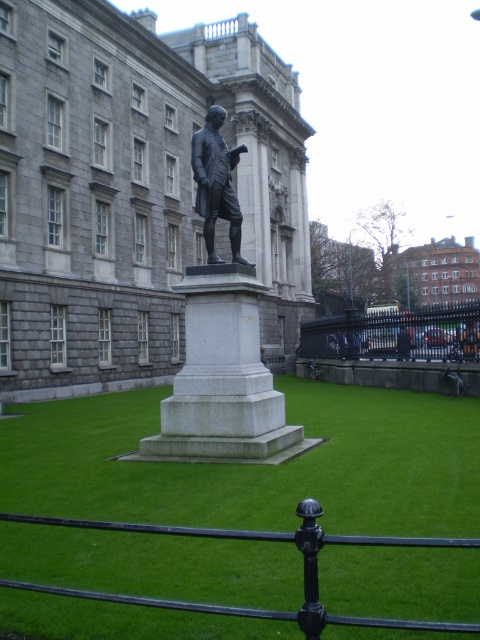
Question: Does polished bronze statue at center appear on the left side of bronze statue at center?

Choices:
 (A) no
 (B) yes

Answer: (B)

Question: Which of the following is the farthest from the observer?

Choices:
 (A) (249, 461)
 (B) (204, 564)
 (C) (228, 200)
 (D) (272, 392)

Answer: (D)

Question: Which point is farther to the camera?

Choices:
 (A) polished bronze statue at center
 (B) white marble pedestal at center

Answer: (A)

Question: Does green grass at center have a smaller size compared to polished bronze statue at center?

Choices:
 (A) yes
 (B) no

Answer: (A)

Question: In this image, where is green grass at center located relative to polished bronze statue at center?

Choices:
 (A) right
 (B) left

Answer: (A)

Question: Which point is farther to the camera?

Choices:
 (A) (172, 481)
 (B) (216, 156)
 (C) (186, 321)

Answer: (C)